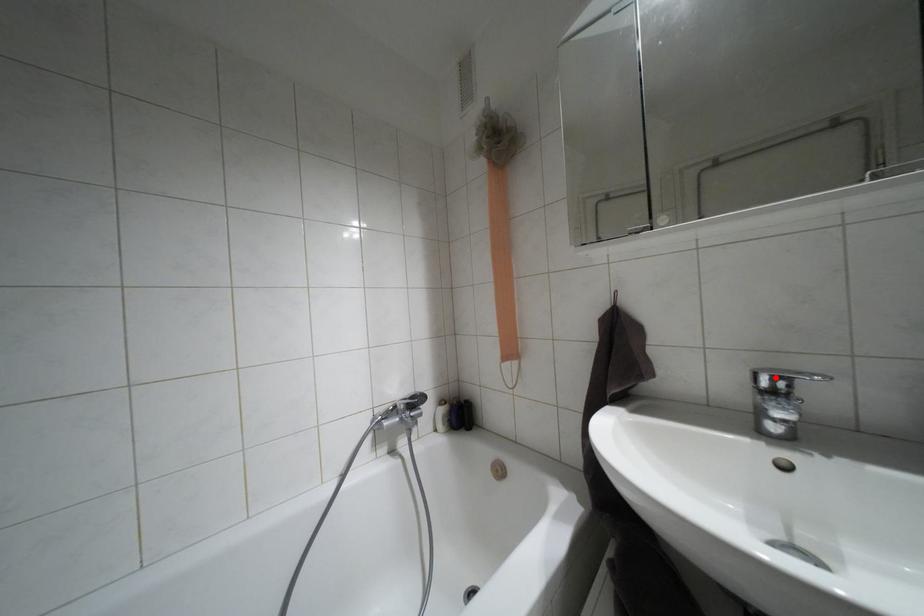
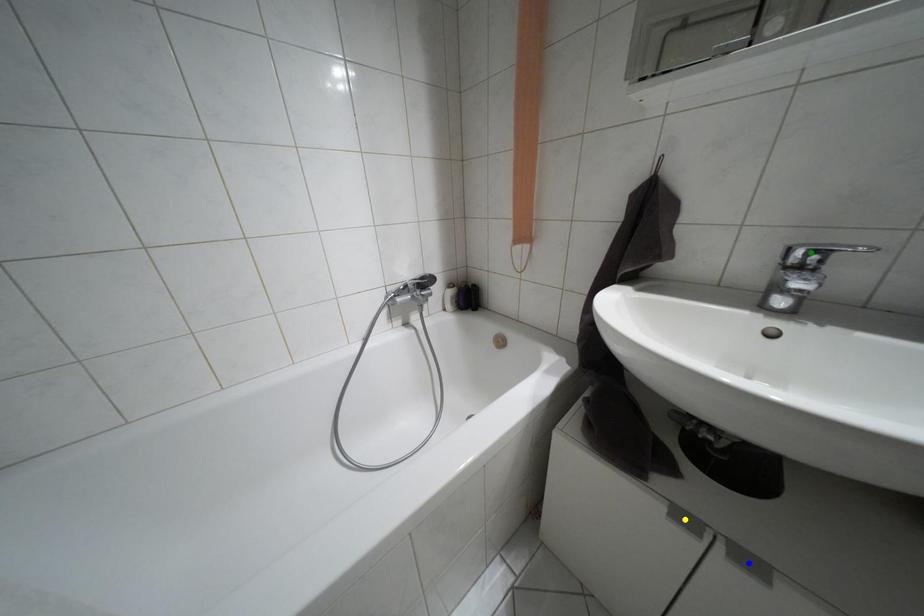
Question: I am providing you with two images of the same scene from different viewpoints. A red point is marked on the first image. You are given multiple points on the second image. In image 2, which mark is for the same physical point as the one in image 1?

Choices:
 (A) green point
 (B) blue point
 (C) yellow point

Answer: (A)